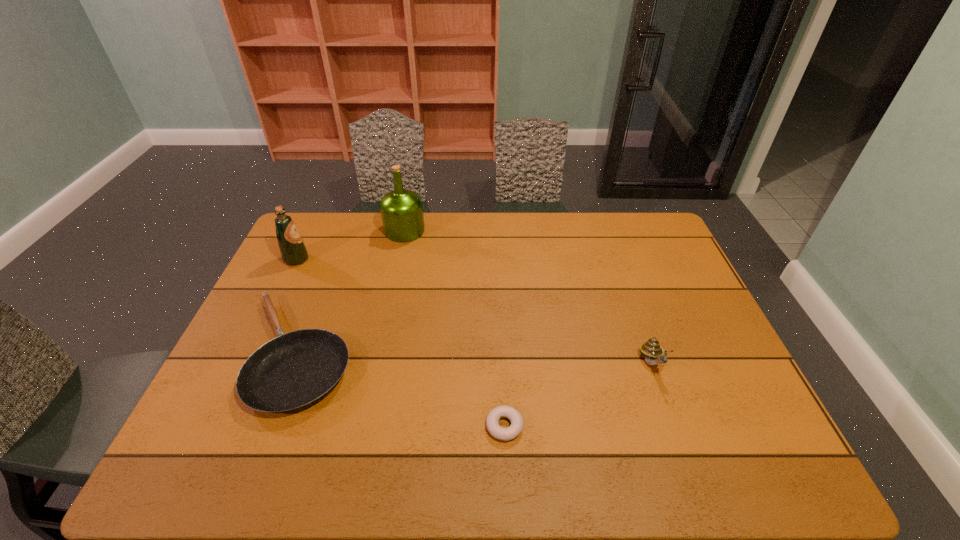
The image size is (960, 540). I want to click on the farthest object, so click(x=401, y=209).

At what (x,y) coordinates should I click in order to perform the action: click on the tallest object. Please return your answer as a coordinate pair (x, y). Image resolution: width=960 pixels, height=540 pixels. Looking at the image, I should click on (401, 209).

In order to click on the shorter olive oil in this screenshot , I will do `click(293, 250)`.

Where is `the fourth nearest object`? the fourth nearest object is located at coordinates (293, 250).

I want to click on the rightmost object, so click(x=651, y=349).

Where is `snail`? The image size is (960, 540). snail is located at coordinates (x=651, y=349).

Locate an element on the screen. Image resolution: width=960 pixels, height=540 pixels. frying pan is located at coordinates (293, 371).

Find the location of `the fourth object from left to right`. the fourth object from left to right is located at coordinates (504, 434).

What are the coordinates of `doughnut` in the screenshot? It's located at (504, 434).

Image resolution: width=960 pixels, height=540 pixels. What are the coordinates of `vacant space situated on the left of the right olive oil` in the screenshot? It's located at (346, 231).